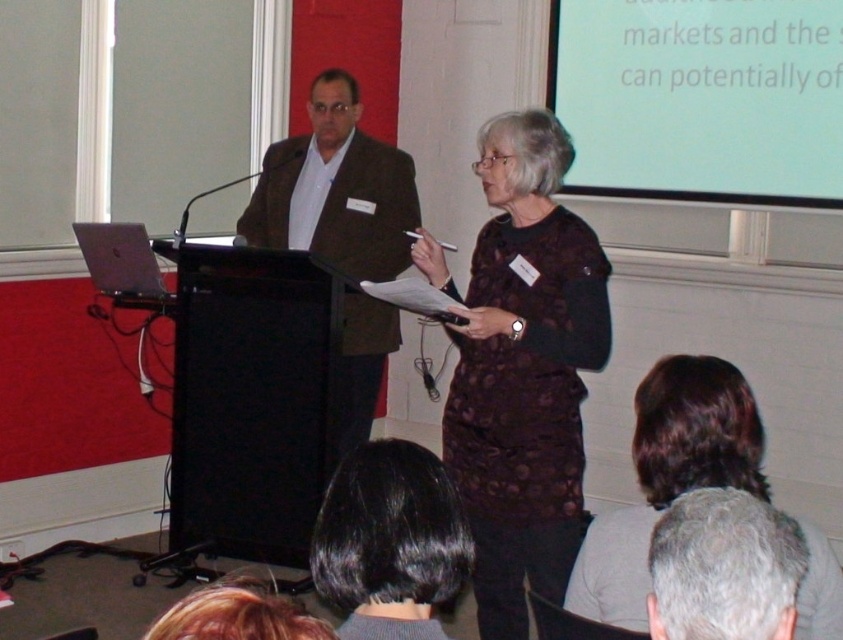
Question: Which point is closer to the camera?

Choices:
 (A) gray hair at upper center
 (B) black hair at lower center
 (C) dark brown hair at upper center
 (D) white matte projection screen at upper center

Answer: (A)

Question: Can you confirm if brown textured suit at center is positioned to the left of black hair at lower center?

Choices:
 (A) yes
 (B) no

Answer: (A)

Question: Where is dark brown hair at upper center located in relation to black hair at lower center in the image?

Choices:
 (A) left
 (B) right

Answer: (B)

Question: Which object is positioned closest to the dark brown hair at upper center?

Choices:
 (A) dark brown textured dress at center
 (B) gray hair at upper center
 (C) brown textured suit at center

Answer: (B)

Question: Is white matte projection screen at upper center positioned in front of gray hair at upper center?

Choices:
 (A) yes
 (B) no

Answer: (B)

Question: Which point is farther to the camera?

Choices:
 (A) dark brown textured dress at center
 (B) brown textured suit at center

Answer: (B)